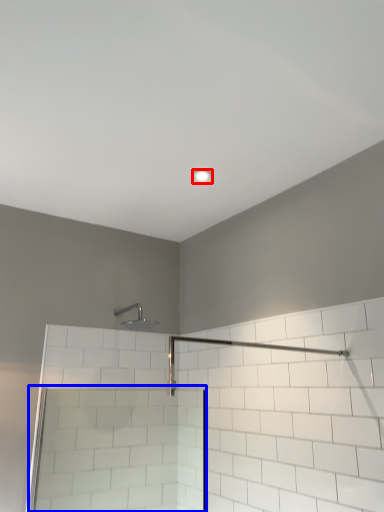
Question: Which object appears farthest to the camera in this image, light fixture (highlighted by a red box) or screen door (highlighted by a blue box)?

Choices:
 (A) light fixture
 (B) screen door

Answer: (A)